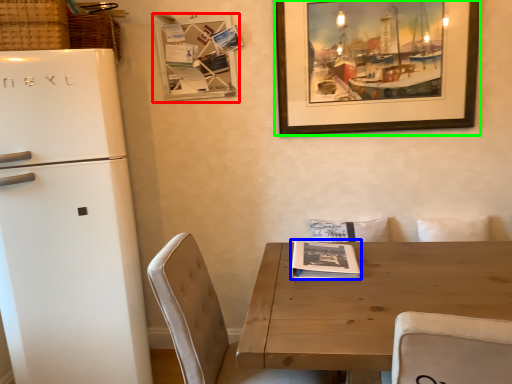
Question: Which object is the farthest from bulletin board (highlighted by a red box)? Choose among these: magazine (highlighted by a blue box) or picture frame (highlighted by a green box).

Choices:
 (A) magazine
 (B) picture frame

Answer: (A)